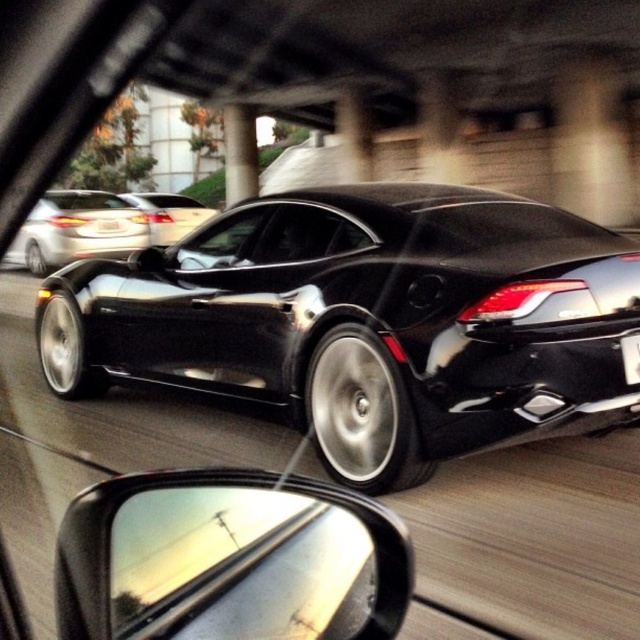
In the scene shown: You are driving a car and want to check your blind spot. The black plastic side mirror at lower left is your only tool. Can you see an object 3 feet away from the camera using this mirror?

The black plastic side mirror at lower left is 31.82 inches from the camera. Since 3 feet equals 36 inches, the object is farther away than the mirror, so you cannot see it using the mirror.

You are sitting in the passenger seat of a car and looking out through the windshield. You see two points marked on the road ahead. The first point is at coordinates point (x=337, y=627) and the second point is at point (x=108, y=228). Which point is closer to your car?

Point (x=337, y=627) is closer to the camera than point (x=108, y=228).